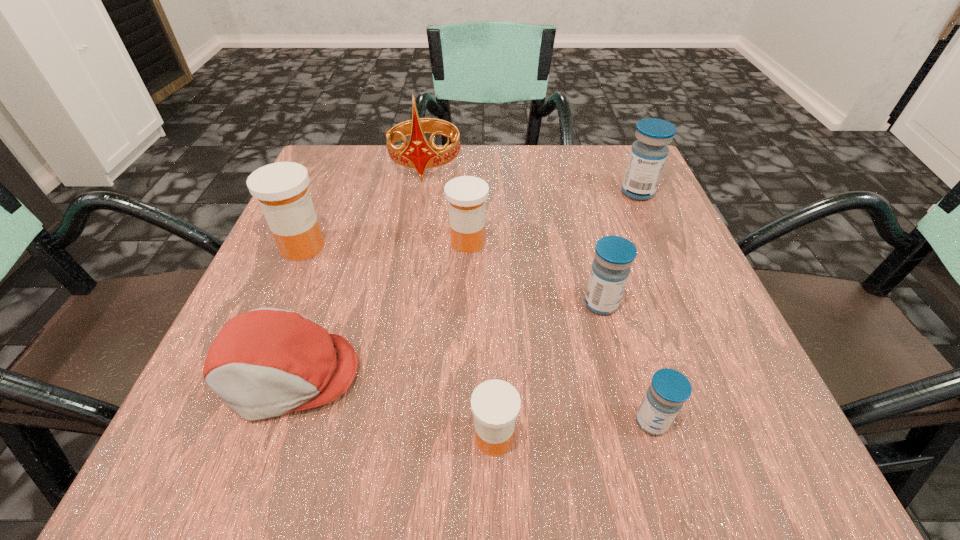
The image size is (960, 540). I want to click on empty space that is in between the second smallest orange medicine and the smallest orange medicine, so click(481, 340).

Where is `free space between the biggest orange medicine and the fourth farthest medicine`? Image resolution: width=960 pixels, height=540 pixels. free space between the biggest orange medicine and the fourth farthest medicine is located at coordinates (452, 275).

Choose which object is the second nearest neighbor to the red tiara. Please provide its 2D coordinates. Your answer should be formatted as a tuple, i.e. [(x, y)], where the tuple contains the x and y coordinates of a point satisfying the conditions above.

[(281, 188)]

The height and width of the screenshot is (540, 960). Identify the location of the closest object to the cap. (281, 188).

Where is `medicine that can be found as the fifth closest to the rightmost object`? medicine that can be found as the fifth closest to the rightmost object is located at coordinates [x=281, y=188].

Point out which medicine is positioned as the fourth nearest to the smallest orange medicine. Please provide its 2D coordinates. Your answer should be formatted as a tuple, i.e. [(x, y)], where the tuple contains the x and y coordinates of a point satisfying the conditions above.

[(281, 188)]

Select which blue medicine is the closest to the nearest blue medicine. Please provide its 2D coordinates. Your answer should be formatted as a tuple, i.e. [(x, y)], where the tuple contains the x and y coordinates of a point satisfying the conditions above.

[(614, 255)]

Identify which blue medicine is the second nearest to the red cap. Please provide its 2D coordinates. Your answer should be formatted as a tuple, i.e. [(x, y)], where the tuple contains the x and y coordinates of a point satisfying the conditions above.

[(669, 389)]

Locate an element on the screen. the third closest orange medicine to the cap is located at coordinates (466, 195).

Identify which orange medicine is located as the second nearest to the second smallest orange medicine. Please provide its 2D coordinates. Your answer should be formatted as a tuple, i.e. [(x, y)], where the tuple contains the x and y coordinates of a point satisfying the conditions above.

[(495, 404)]